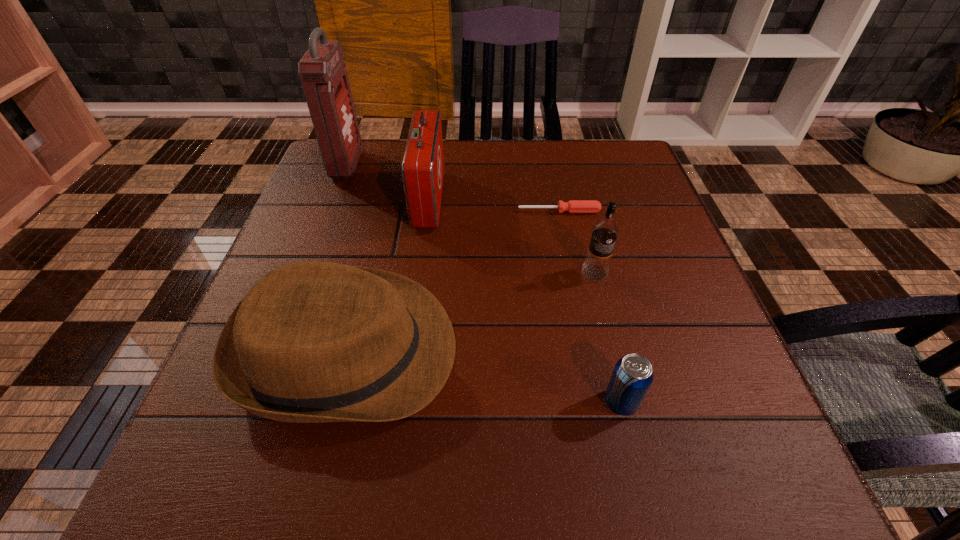
At what (x,y) coordinates should I click in order to perform the action: click on vacant region at the far edge of the desktop. Please return your answer as a coordinate pair (x, y). The width and height of the screenshot is (960, 540). Looking at the image, I should click on (394, 190).

This screenshot has width=960, height=540. I want to click on vacant space at the near edge of the desktop, so click(321, 443).

Identify the location of free space at the left edge of the desktop. (330, 196).

In the image, there is a desktop. What are the coordinates of `vacant space at the right edge` in the screenshot? It's located at (691, 438).

In the image, there is a desktop. What are the coordinates of `blank space at the near left corner` in the screenshot? It's located at (253, 443).

Where is `blank region between the beer can and the fourth tallest object`? The height and width of the screenshot is (540, 960). blank region between the beer can and the fourth tallest object is located at coordinates (484, 376).

Find the location of `vacant area between the taller first-aid kit and the vodka`. vacant area between the taller first-aid kit and the vodka is located at coordinates (471, 219).

Identify the location of free area in between the vodka and the third shortest object. The width and height of the screenshot is (960, 540). (471, 312).

The image size is (960, 540). I want to click on free space between the tallest object and the right first-aid kit, so click(388, 183).

Identify the location of free point between the fourth tallest object and the tallest object. (348, 258).